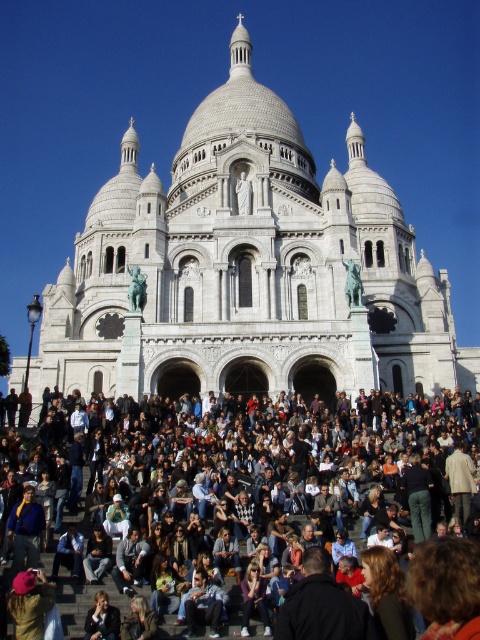
Measure the distance between white stone church at center and camera.

A distance of 62.28 meters exists between white stone church at center and camera.

Is point (115, 241) in front of point (154, 614)?

No, (115, 241) is further to viewer.

Is point (452, 332) less distant than point (123, 632)?

No, it is behind (123, 632).

Where is `white stone church at center`? This screenshot has height=640, width=480. white stone church at center is located at coordinates (248, 268).

Is multicolored fabric crowd at center above brown leather jacket at lower center?

Yes.

Between multicolored fabric crowd at center and brown leather jacket at lower center, which one appears on the left side from the viewer's perspective?

From the viewer's perspective, brown leather jacket at lower center appears more on the left side.

You are a GUI agent. You are given a task and a screenshot of the screen. Output one action in this format:
    pyautogui.click(x=<x>, y=<y>)
    Task: Click on the multicolored fabric crowd at center
    
    Given the screenshot: What is the action you would take?
    pyautogui.click(x=286, y=460)

Between white stone church at center and multicolored fabric crowd at center, which one has more height?

white stone church at center is taller.

Does white stone church at center appear on the left side of multicolored fabric crowd at center?

Indeed, white stone church at center is positioned on the left side of multicolored fabric crowd at center.

Is point (330, 204) positioned before point (202, 438)?

That is False.

Image resolution: width=480 pixels, height=640 pixels. I want to click on white stone church at center, so click(x=248, y=268).